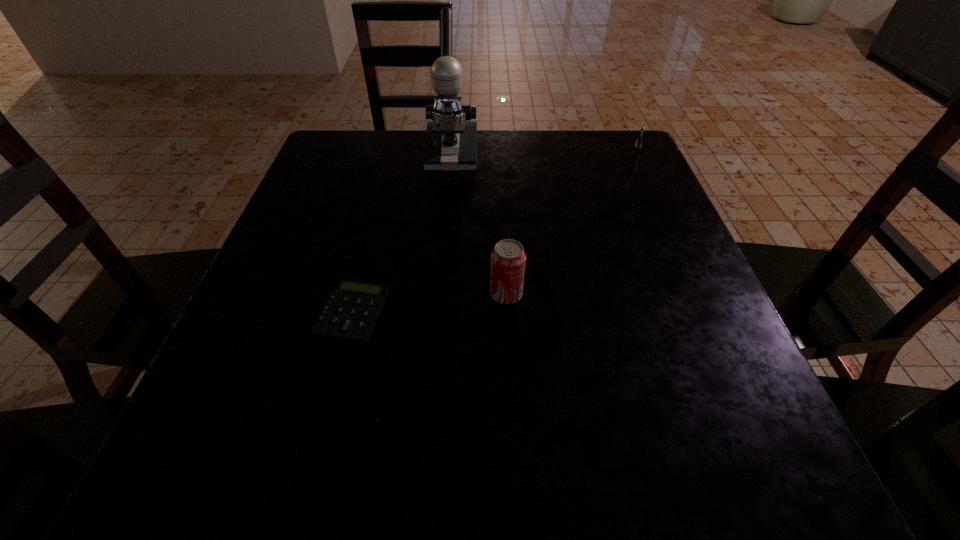
At what (x,y) coordinates should I click in order to perform the action: click on the second object from left to right. Please return your answer as a coordinate pair (x, y). This screenshot has height=540, width=960. Looking at the image, I should click on (450, 144).

The height and width of the screenshot is (540, 960). In order to click on the tallest object in this screenshot , I will do `click(450, 144)`.

Identify the location of the second tallest object. The width and height of the screenshot is (960, 540). (x=508, y=258).

Locate an element on the screen. The width and height of the screenshot is (960, 540). the third object from left to right is located at coordinates (508, 258).

The width and height of the screenshot is (960, 540). Find the location of `padlock`. padlock is located at coordinates (637, 148).

The height and width of the screenshot is (540, 960). Identify the location of the second shortest object. (637, 148).

Where is `calculator`? The height and width of the screenshot is (540, 960). calculator is located at coordinates point(352,310).

Where is `the shortest object`? The image size is (960, 540). the shortest object is located at coordinates (352, 310).

The image size is (960, 540). In order to click on vacant position located 0.210m at the eyepiece of the tallest object in this screenshot , I will do `click(444, 231)`.

You are a GUI agent. You are given a task and a screenshot of the screen. Output one action in this format:
    pyautogui.click(x=<x>, y=<y>)
    Task: Click on the vacant position located 0.250m on the logo side of the third object from left to right
    Image resolution: width=960 pixels, height=540 pixels.
    Given the screenshot: What is the action you would take?
    pyautogui.click(x=346, y=295)